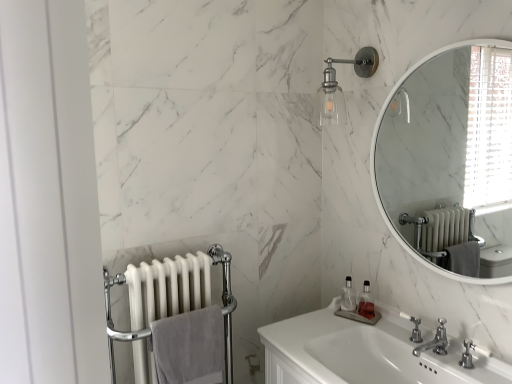
You are a GUI agent. You are given a task and a screenshot of the screen. Output one action in this format:
    pyautogui.click(x=<x>, y=<y>)
    Task: Click on the vacant region to the left of translucent glass soap dispenser at lower center, which is counted as the 2th soap dispenser, starting from the left
    The height and width of the screenshot is (384, 512).
    Given the screenshot: What is the action you would take?
    pyautogui.click(x=318, y=316)